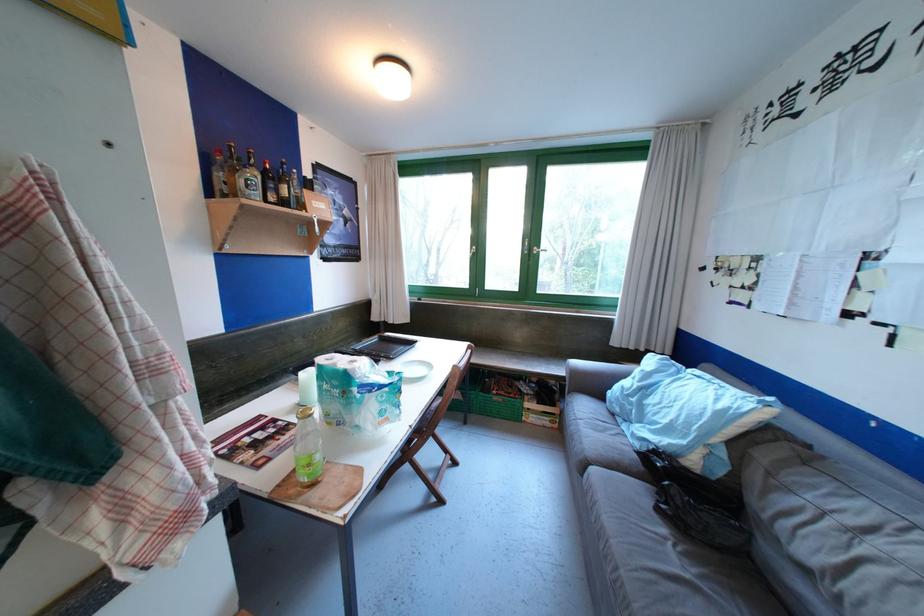
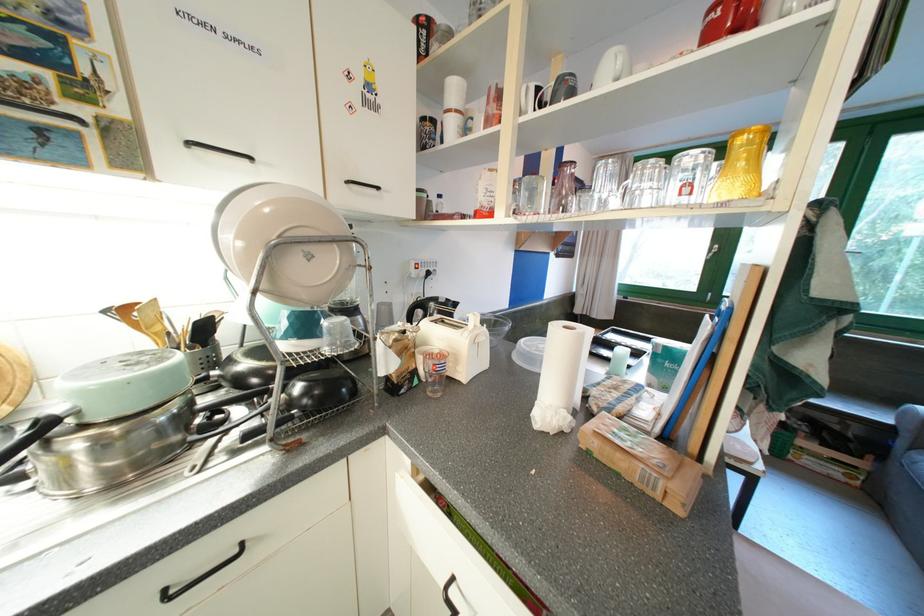
Question: I am providing you with two images of the same scene from different viewpoints. After the viewpoint changes to image2, which objects are now occluded?

Choices:
 (A) pot lid handle
 (B) blue trash can lid
 (C) black laptop computer
 (D) black drawer handle

Answer: (C)